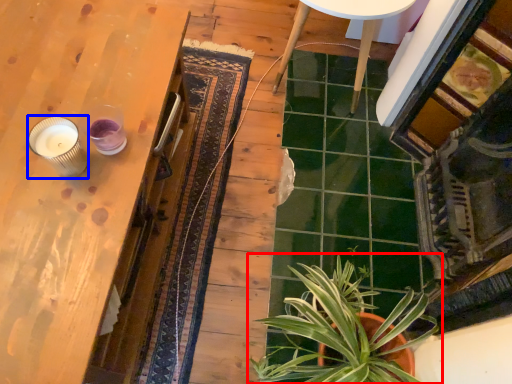
Question: Which of the following is the farthest to the observer, houseplant (highlighted by a red box) or candle holder (highlighted by a blue box)?

Choices:
 (A) houseplant
 (B) candle holder

Answer: (A)